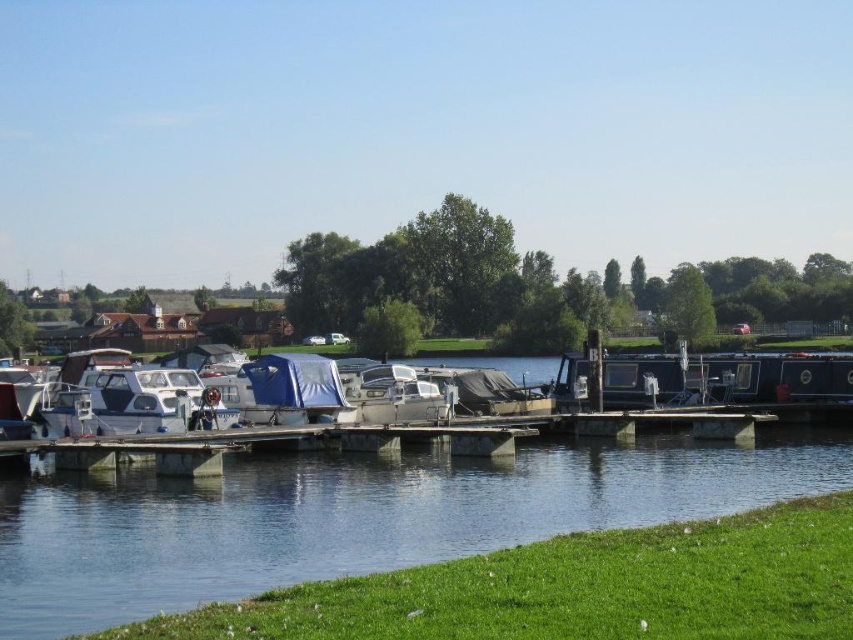
You are standing at the riverside and want to locate two specific points in the scene. The first point is at coordinates point (399,518) and the second is at point (370,385). Which of these two points is positioned closer to your current viewpoint?

Point (399,518) is closer to the viewer than point (370,385).

You need to cross the river using a small raft that can only carry items narrower than the metallic silver boat at center. Can you safely carry the clear water at center across the river?

The clear water at center might be wider than metallic silver boat at center, so the raft cannot safely carry the clear water at center since it may exceed the width limit.